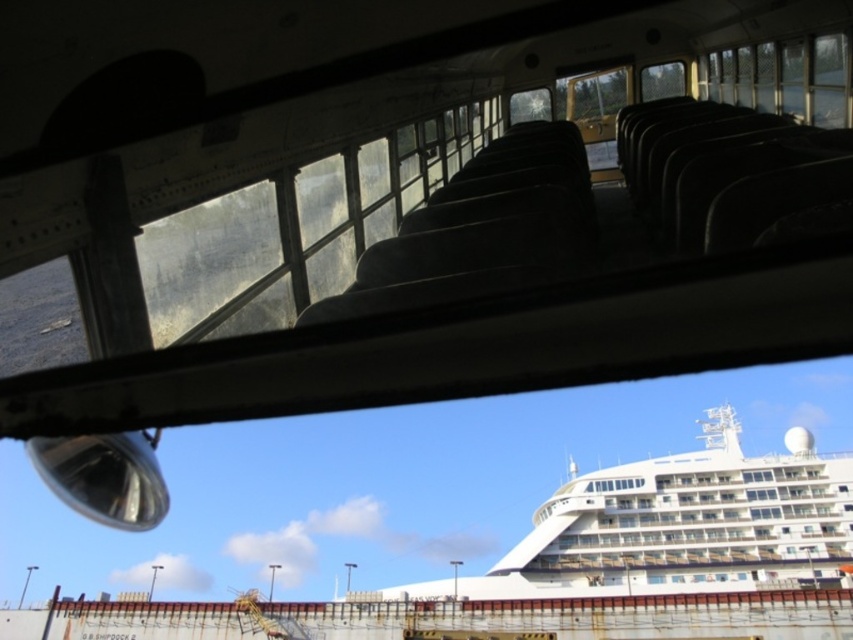
Can you confirm if white glossy cruise ship at center is taller than transparent plastic view mirror at lower left?

Correct, white glossy cruise ship at center is much taller as transparent plastic view mirror at lower left.

Is white glossy cruise ship at center positioned behind transparent plastic view mirror at lower left?

Yes, white glossy cruise ship at center is behind transparent plastic view mirror at lower left.

I want to click on white glossy cruise ship at center, so click(x=677, y=525).

Find the location of a particular element. The height and width of the screenshot is (640, 853). white glossy cruise ship at center is located at coordinates (677, 525).